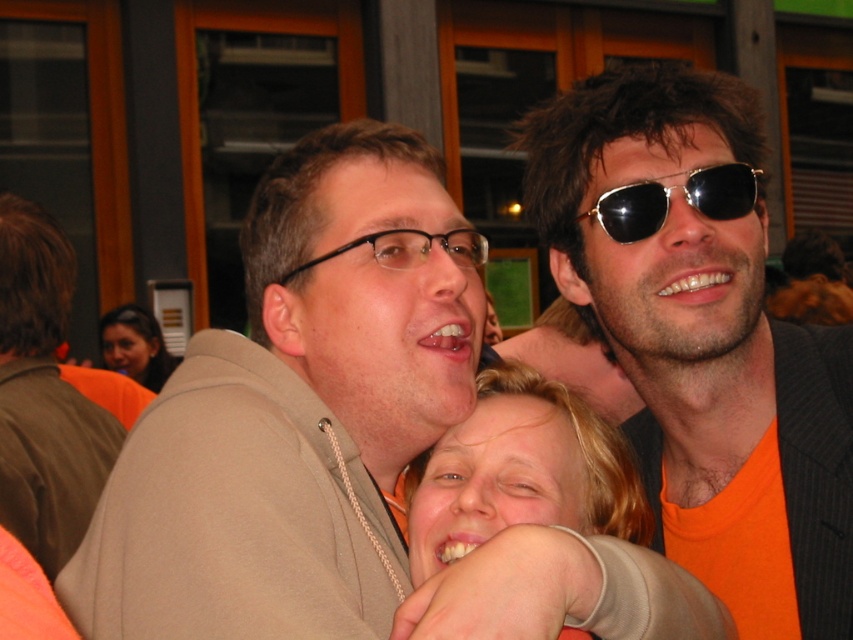
Question: Can you confirm if shiny black sunglasses at upper right is wider than gold reflective sunglasses at upper right?

Choices:
 (A) yes
 (B) no

Answer: (A)

Question: Which object is farther from the camera taking this photo?

Choices:
 (A) blonde hair at center
 (B) matte brown jacket at left
 (C) gold reflective sunglasses at upper right

Answer: (B)

Question: Estimate the real-world distances between objects in this image. Which object is closer to the matte orange shirt at upper left?

Choices:
 (A) matte beige hoodie at center
 (B) blonde hair at center

Answer: (A)

Question: Can you confirm if gold reflective sunglasses at upper right is positioned to the right of black plastic glasses at center?

Choices:
 (A) no
 (B) yes

Answer: (B)

Question: Does shiny black sunglasses at upper right have a lesser width compared to gold reflective sunglasses at upper right?

Choices:
 (A) no
 (B) yes

Answer: (A)

Question: Which is farther from the black plastic glasses at center?

Choices:
 (A) gold reflective sunglasses at upper right
 (B) shiny black sunglasses at upper right
 (C) matte beige hoodie at center
 (D) blonde hair at center

Answer: (B)